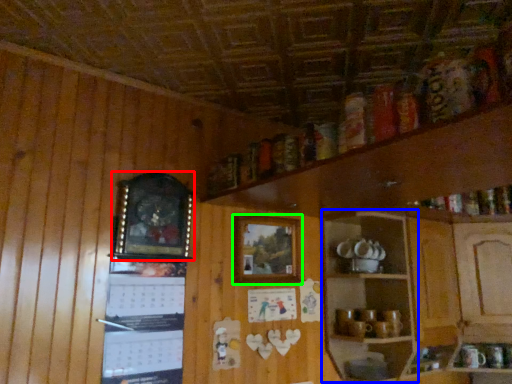
Question: Estimate the real-world distances between objects in this image. Which object is farther from picture frame (highlighted by a red box), shelf (highlighted by a blue box) or picture frame (highlighted by a green box)?

Choices:
 (A) shelf
 (B) picture frame

Answer: (A)